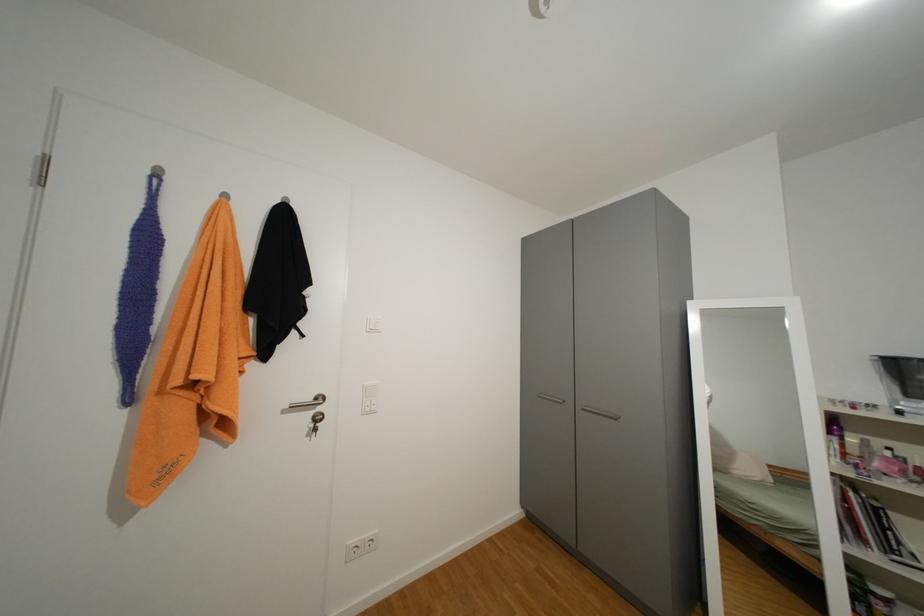
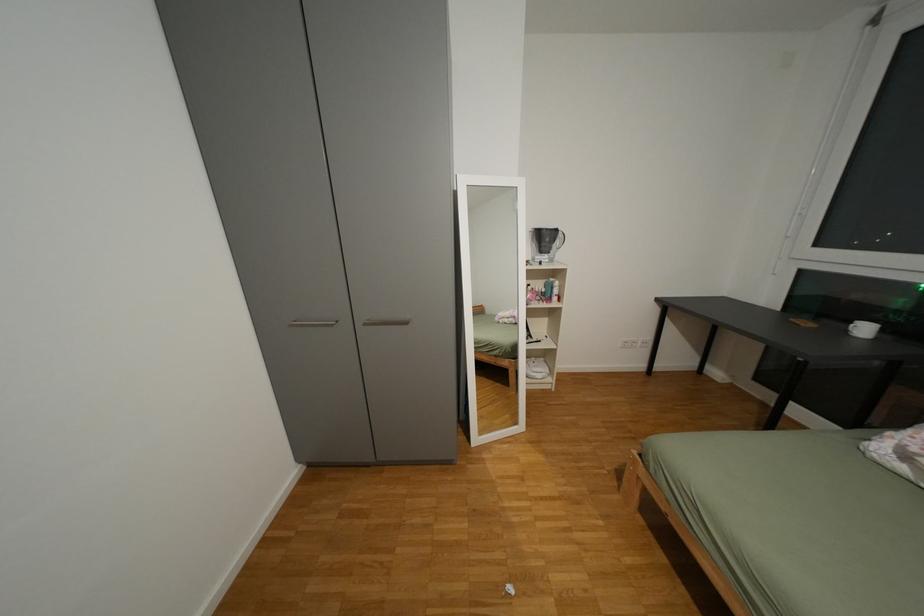
Based on the continuous images, in which direction is the camera rotating?

The camera rotated toward right-down.